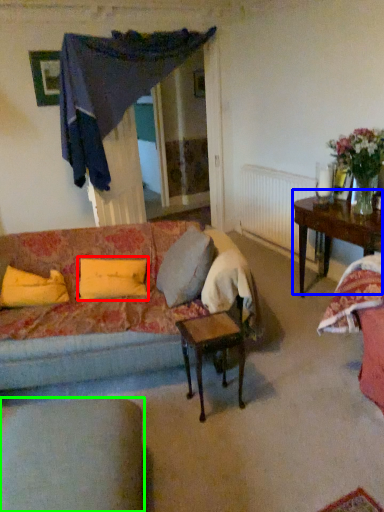
Question: Which object is the farthest from pillow (highlighted by a red box)? Choose among these: table (highlighted by a blue box) or chair (highlighted by a green box).

Choices:
 (A) table
 (B) chair

Answer: (A)